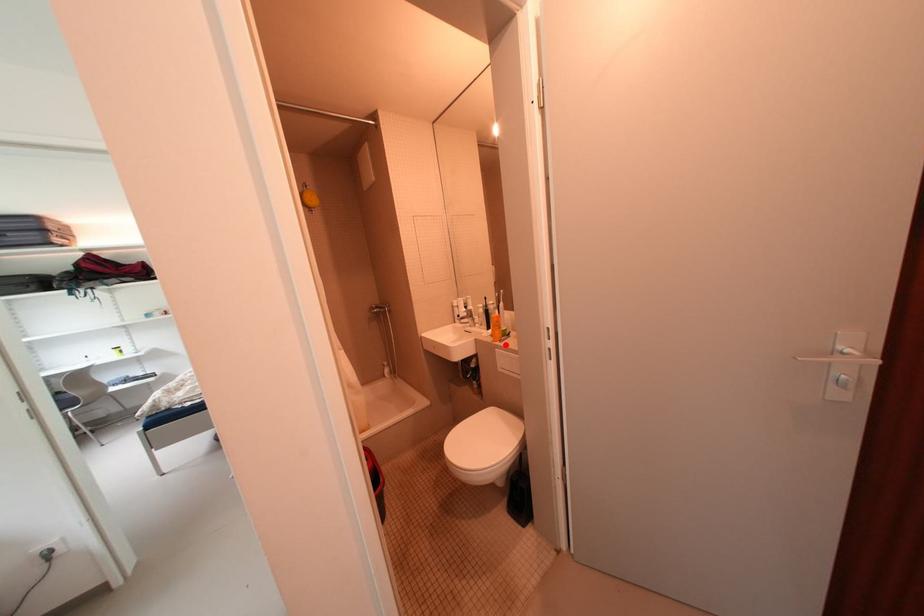
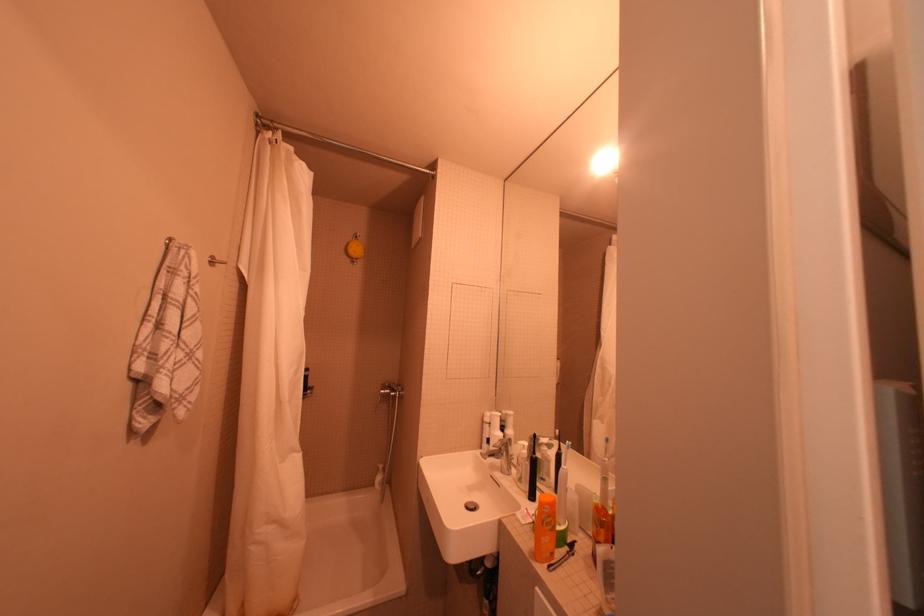
The point at the highlighted location is marked in the first image. Where is the corresponding point in the second image?

(551, 570)